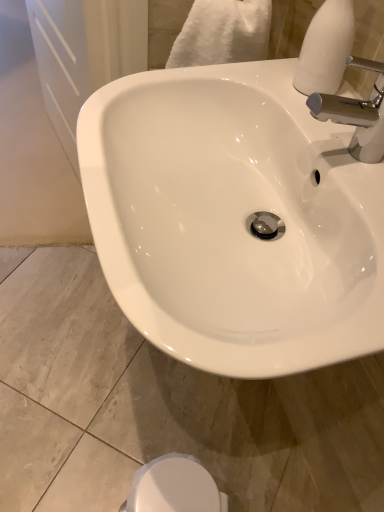
Question: Looking at their shapes, would you say white matte soap dispenser at upper right is wider or thinner than white glossy bidet at lower center?

Choices:
 (A) wide
 (B) thin

Answer: (B)

Question: From the image's perspective, is white matte soap dispenser at upper right above or below white glossy bidet at lower center?

Choices:
 (A) above
 (B) below

Answer: (A)

Question: Estimate the real-world distances between objects in this image. Which object is farther from the white glossy bidet at lower center?

Choices:
 (A) white matte soap dispenser at upper right
 (B) white glossy sink at center
 (C) chrome metallic faucet at upper right

Answer: (A)

Question: Which object is positioned farthest from the chrome metallic faucet at upper right?

Choices:
 (A) white glossy sink at center
 (B) white glossy bidet at lower center
 (C) white matte soap dispenser at upper right

Answer: (B)